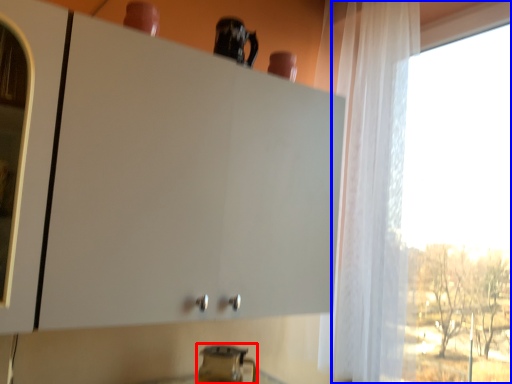
Question: Which object is further to the camera taking this photo, appliance (highlighted by a red box) or window (highlighted by a blue box)?

Choices:
 (A) appliance
 (B) window

Answer: (A)